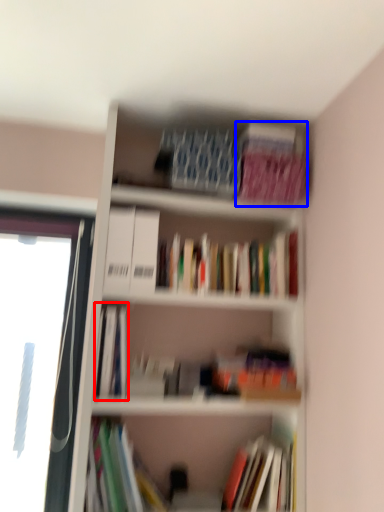
Question: Which object appears closest to the camera in this image, book (highlighted by a red box) or paperback book (highlighted by a blue box)?

Choices:
 (A) book
 (B) paperback book

Answer: (A)